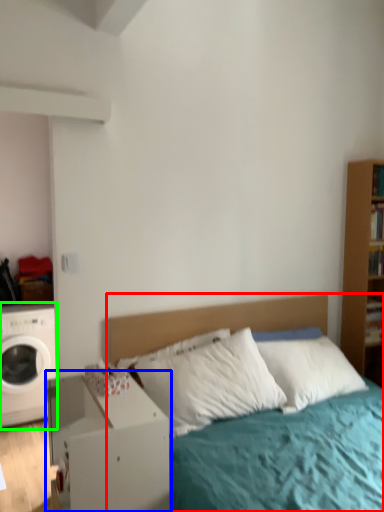
Question: Which is nearer to the bed (highlighted by a red box)? nightstand (highlighted by a blue box) or washing machine (highlighted by a green box).

Choices:
 (A) nightstand
 (B) washing machine

Answer: (A)